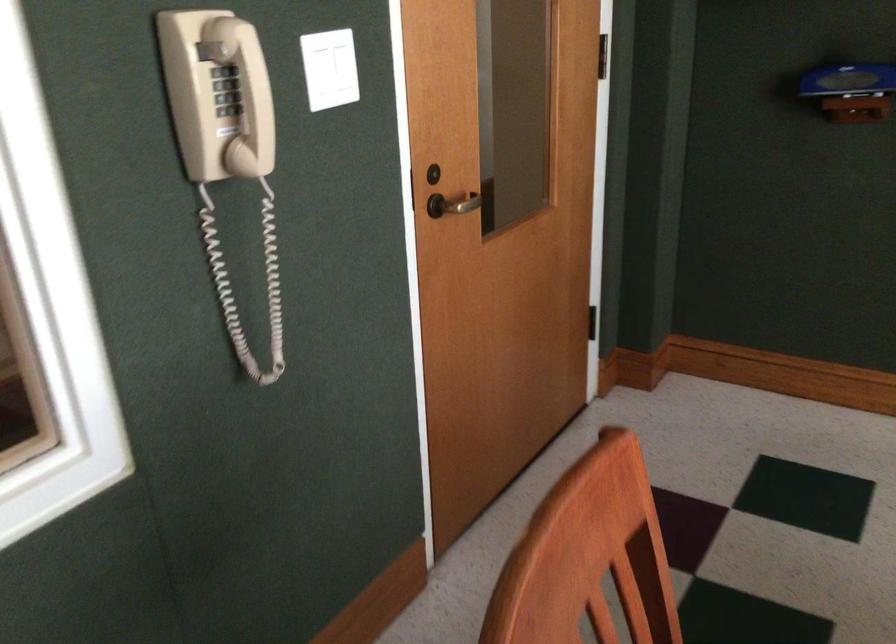
Find the location of a particular element. door lock is located at coordinates (409, 191).